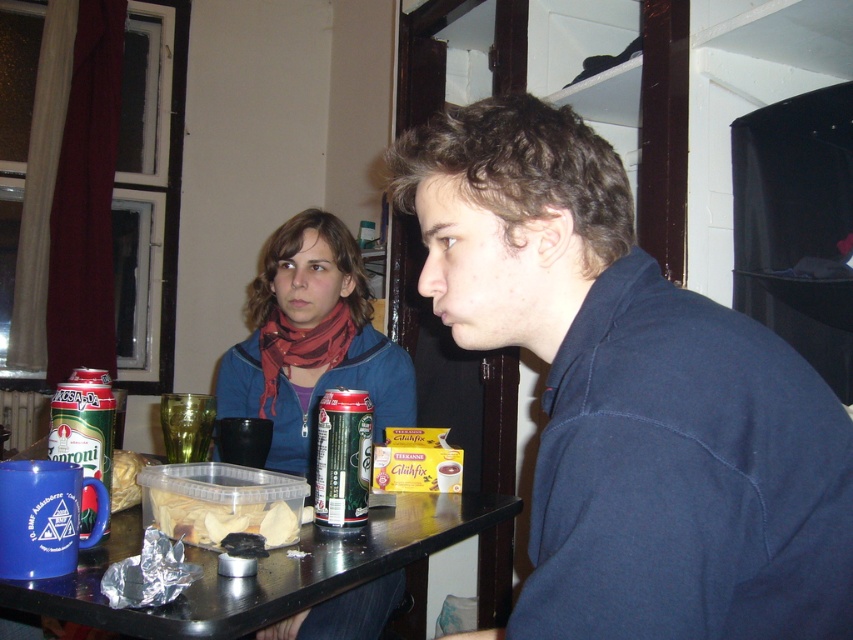
You are a delivery person who needs to place a small package on the table between the black plastic table at lower center and the matte plastic container of chips at table center. Can you fit the package there if it measures 5 inches in length?

The distance between the black plastic table at lower center and the matte plastic container of chips at table center is 4.68 inches. Since the package is 5 inches long, it won

You are sitting at the table between the two people. You need to place a small object on the table. The first point is point (498,177) and the second is point (383,360). Which point is closer to you?

Point (498,177) is in front of point (383,360), so it is closer to you.

You are a photographer setting up a shoot in this room. You want to place a small prop between the blue fleece jacket at center and the blue fabric scarf at upper left so it appears centered in the photo. Given their positions, where should you position the prop relative to these two items?

Since the blue fleece jacket at center is closer to the viewer than the blue fabric scarf at upper left, you should place the prop closer to the blue fabric scarf at upper left to make it appear centered in the photo.